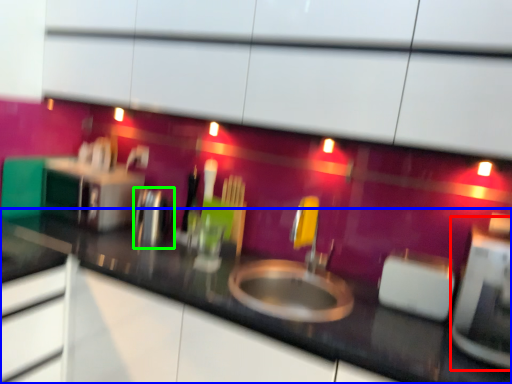
Question: Which object is positioned closest to appliance (highlighted by a red box)? Select from countertop (highlighted by a blue box) and appliance (highlighted by a green box).

Choices:
 (A) countertop
 (B) appliance

Answer: (A)